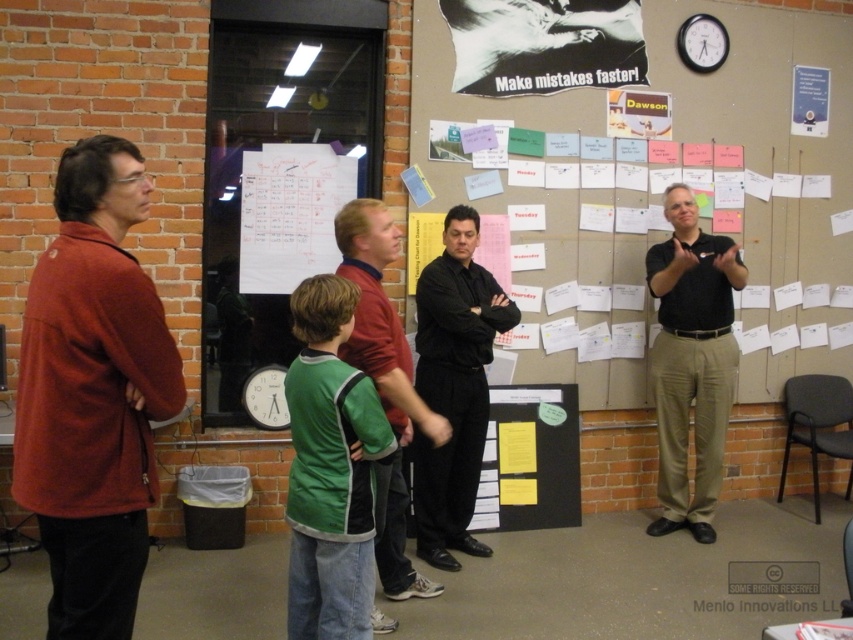
You are standing in the room and want to move from point A to point B. Point A is at coordinates point (316, 516) and point B is at coordinates point (722, 449). Which point is closer to you?

Point (316, 516) is closer to the viewer than point (722, 449).

You are organizing a classroom and need to decide where to place a new large bulletin board. The white paper notes at center and the matte blue poster at upper right are already present. Which object should the bulletin board be placed next to to avoid overlapping with the larger one?

The white paper notes at center is bigger than the matte blue poster at upper right. Therefore, the bulletin board should be placed next to the matte blue poster at upper right to avoid overlapping with the larger object.

You are standing in the room and want to greet the person wearing the green jersey at center and the person in the black smooth shirt at right. Which one should you approach first if you want to greet the person closer to the entrance located on the left side of the room?

You should approach the green jersey at center first because it is to the left of the black smooth shirt at right, making it closer to the entrance on the left side of the room.